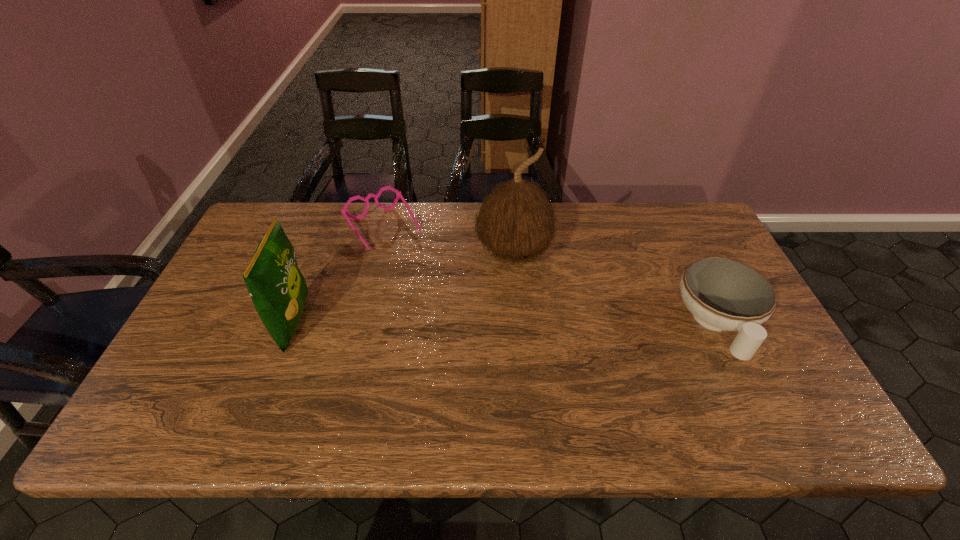
Image resolution: width=960 pixels, height=540 pixels. I want to click on vacant area at the near edge, so click(x=539, y=372).

In order to click on free space at the left edge in this screenshot , I will do `click(194, 329)`.

At what (x,y) coordinates should I click in order to perform the action: click on blank area at the right edge. Please return your answer as a coordinate pair (x, y). The width and height of the screenshot is (960, 540). Looking at the image, I should click on (709, 255).

Locate an element on the screen. The width and height of the screenshot is (960, 540). vacant space at the far right corner of the desktop is located at coordinates (687, 204).

Find the location of `unoccupied area between the rightmost object and the crisp (potato chip)`. unoccupied area between the rightmost object and the crisp (potato chip) is located at coordinates (506, 324).

Find the location of a particular element. vacant region between the spectacles and the chinaware is located at coordinates (550, 276).

The width and height of the screenshot is (960, 540). Identify the location of vacant space that's between the tallest object and the chinaware. (615, 289).

You are a GUI agent. You are given a task and a screenshot of the screen. Output one action in this format:
    pyautogui.click(x=<x>, y=<y>)
    Task: Click on the blank region between the third tallest object and the second tallest object
    
    Given the screenshot: What is the action you would take?
    pyautogui.click(x=506, y=324)

At what (x,y) coordinates should I click in order to perform the action: click on free space between the tallest object and the shortest object. Please return your answer as a coordinate pair (x, y). This screenshot has height=540, width=960. Looking at the image, I should click on (448, 240).

Where is `unoccupied position between the chinaware and the tallest object`? The image size is (960, 540). unoccupied position between the chinaware and the tallest object is located at coordinates (615, 289).